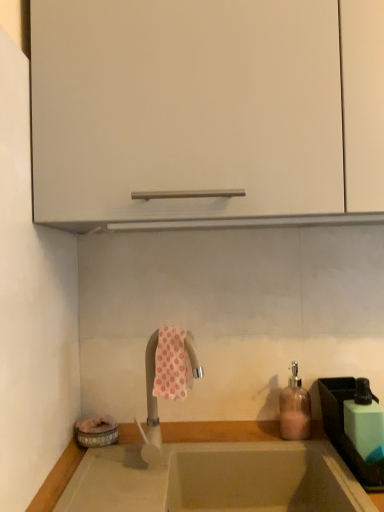
Looking at this image, measure the distance between white matte cabinet at upper center and camera.

white matte cabinet at upper center and camera are 31.66 inches apart from each other.

Locate an element on the screen. The width and height of the screenshot is (384, 512). green matte soap dispenser at right is located at coordinates (365, 422).

This screenshot has width=384, height=512. I want to click on silver metallic tap at center, so click(x=151, y=408).

This screenshot has height=512, width=384. What do you see at coordinates (344, 431) in the screenshot? I see `green plastic sink at lower right` at bounding box center [344, 431].

Based on the photo, what is the approximate height of green plastic sink at lower right?

green plastic sink at lower right is 5.18 inches in height.

In order to face smooth beige countertop at lower center, should I rotate leftwards or rightwards?

You should look right and rotate roughly 2.211 degrees.

At what (x,y) coordinates should I click in order to perform the action: click on white matte cabinet at upper center. Please return your answer as a coordinate pair (x, y). Looking at the image, I should click on (206, 113).

Can you confirm if white matte cabinet at upper center is taller than pink glass soap dispenser at right?

Indeed, white matte cabinet at upper center has a greater height compared to pink glass soap dispenser at right.

Which of these two, white matte cabinet at upper center or pink glass soap dispenser at right, is thinner?

pink glass soap dispenser at right is thinner.

Which is behind, point (58, 201) or point (296, 406)?

The point (296, 406) is more distant.

From a real-world perspective, is white matte cabinet at upper center positioned above or below pink glass soap dispenser at right?

From a real-world perspective, white matte cabinet at upper center is physically above pink glass soap dispenser at right.

Is point (294, 407) farther from camera compared to point (210, 435)?

Yes, it is behind point (210, 435).

Based on the photo, is pink glass soap dispenser at right taller than smooth beige countertop at lower center?

Correct, pink glass soap dispenser at right is much taller as smooth beige countertop at lower center.

Is pink glass soap dispenser at right next to smooth beige countertop at lower center and touching it?

pink glass soap dispenser at right and smooth beige countertop at lower center are not in contact.

Looking at this image, would you consider pink glass soap dispenser at right to be distant from silver metallic tap at center?

No, there isn't a large distance between pink glass soap dispenser at right and silver metallic tap at center.

Considering the positions of objects pink glass soap dispenser at right and silver metallic tap at center in the image provided, who is more to the right, pink glass soap dispenser at right or silver metallic tap at center?

pink glass soap dispenser at right.

From the picture: Which is closer, (307, 431) or (156, 404)?

Point (307, 431) appears to be closer to the viewer than point (156, 404).

Is silver metallic tap at center inside pink glass soap dispenser at right?

No, silver metallic tap at center is not inside pink glass soap dispenser at right.

Considering the sizes of objects green plastic sink at lower right and smooth beige countertop at lower center in the image provided, who is wider, green plastic sink at lower right or smooth beige countertop at lower center?

green plastic sink at lower right.

Where is `countertop that is in front of the green plastic sink at lower right`? The height and width of the screenshot is (512, 384). countertop that is in front of the green plastic sink at lower right is located at coordinates (221, 431).

Is green plastic sink at lower right next to smooth beige countertop at lower center?

green plastic sink at lower right and smooth beige countertop at lower center are not in contact.

Considering the points (338, 398) and (272, 437), which point is behind, point (338, 398) or point (272, 437)?

The point (272, 437) is farther.

Is white matte cabinet at upper center thinner than silver metallic tap at center?

In fact, white matte cabinet at upper center might be wider than silver metallic tap at center.

Is white matte cabinet at upper center not close to silver metallic tap at center?

No.

Is white matte cabinet at upper center turned away from silver metallic tap at center?

No, silver metallic tap at center is not at the back of white matte cabinet at upper center.

Is point (353, 446) closer or farther from the camera than point (171, 384)?

Clearly, point (353, 446) is more distant from the camera than point (171, 384).

Considering the relative sizes of green plastic sink at lower right and pink floral fabric at center in the image provided, is green plastic sink at lower right taller than pink floral fabric at center?

No.

Considering the positions of objects green plastic sink at lower right and pink floral fabric at center in the image provided, who is more to the right, green plastic sink at lower right or pink floral fabric at center?

Positioned to the right is green plastic sink at lower right.

Is green plastic sink at lower right situated inside pink floral fabric at center or outside?

green plastic sink at lower right cannot be found inside pink floral fabric at center.

How many degrees apart are the facing directions of silver metallic tap at center and pink glass soap dispenser at right?

49 degrees separate the facing orientations of silver metallic tap at center and pink glass soap dispenser at right.

Is silver metallic tap at center positioned far away from pink glass soap dispenser at right?

silver metallic tap at center is near pink glass soap dispenser at right, not far away.

Is silver metallic tap at center wider than pink glass soap dispenser at right?

Indeed, silver metallic tap at center has a greater width compared to pink glass soap dispenser at right.

Where is `tap on the left of pink glass soap dispenser at right`? The height and width of the screenshot is (512, 384). tap on the left of pink glass soap dispenser at right is located at coordinates (151, 408).

Locate an element on the screen. cabinetry that appears on the left of pink glass soap dispenser at right is located at coordinates (206, 113).

Where is `soap dispenser located behind the smooth beige countertop at lower center`? soap dispenser located behind the smooth beige countertop at lower center is located at coordinates (295, 409).

Based on their spatial positions, is pink floral fabric at center or pink glass soap dispenser at right closer to green matte soap dispenser at right?

pink glass soap dispenser at right lies closer to green matte soap dispenser at right than the other object.

Estimate the real-world distances between objects in this image. Which object is closer to green plastic sink at lower right, white matte cabinet at upper center or silver metallic tap at center?

silver metallic tap at center is positioned closer to the anchor green plastic sink at lower right.

Based on the photo, looking at the image, which one is located further to pink floral fabric at center, green matte soap dispenser at right or green plastic sink at lower right?

green plastic sink at lower right.

When comparing their distances from pink glass soap dispenser at right, does green plastic sink at lower right or silver metallic tap at center seem closer?

The object closer to pink glass soap dispenser at right is green plastic sink at lower right.

Looking at the image, which one is located further to pink floral fabric at center, silver metallic tap at center or green plastic sink at lower right?

green plastic sink at lower right is positioned further to the anchor pink floral fabric at center.

Estimate the real-world distances between objects in this image. Which object is closer to green plastic sink at lower right, green matte soap dispenser at right or pink floral fabric at center?

green matte soap dispenser at right.

In the scene shown: Which object lies further to the anchor point smooth beige countertop at lower center, pink glass soap dispenser at right or white matte cabinet at upper center?

white matte cabinet at upper center is positioned further to the anchor smooth beige countertop at lower center.

Estimate the real-world distances between objects in this image. Which object is further from green matte soap dispenser at right, white matte cabinet at upper center or silver metallic tap at center?

white matte cabinet at upper center.

Find the location of a particular element. This screenshot has width=384, height=512. tap between white matte cabinet at upper center and smooth beige countertop at lower center from top to bottom is located at coordinates (151, 408).

Locate an element on the screen. The height and width of the screenshot is (512, 384). beach towel between white matte cabinet at upper center and green matte soap dispenser at right in the vertical direction is located at coordinates (172, 365).

I want to click on soap dispenser located between smooth beige countertop at lower center and green matte soap dispenser at right in the left-right direction, so click(295, 409).

Where is `soap dispenser situated between silver metallic tap at center and green matte soap dispenser at right from left to right`? soap dispenser situated between silver metallic tap at center and green matte soap dispenser at right from left to right is located at coordinates (295, 409).